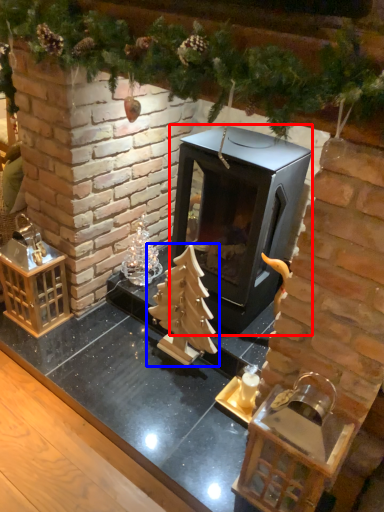
Question: Which object is further to the camera taking this photo, fireplace (highlighted by a red box) or christmas tree (highlighted by a blue box)?

Choices:
 (A) fireplace
 (B) christmas tree

Answer: (B)